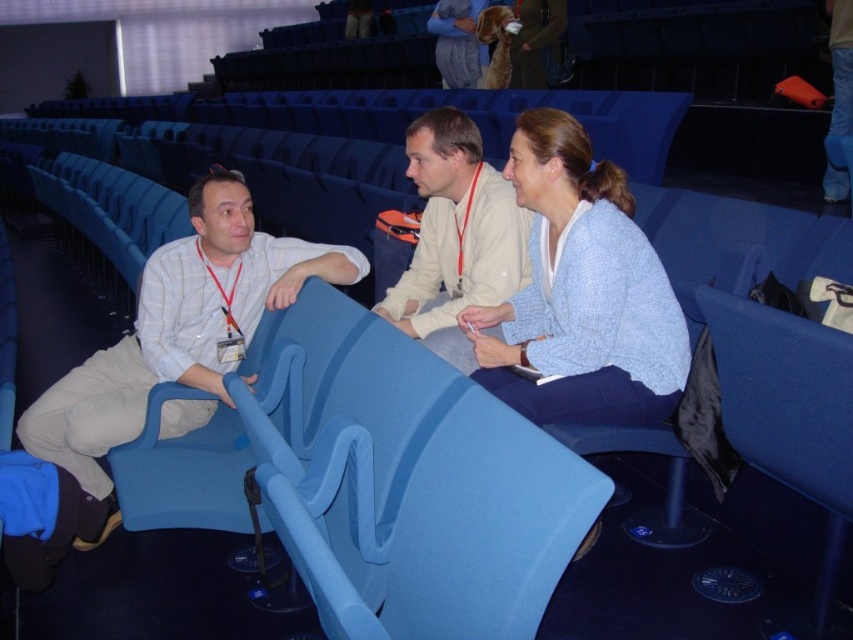
Question: Estimate the real-world distances between objects in this image. Which object is farther from the light blue knit sweater at center?

Choices:
 (A) white striped shirt at left
 (B) light beige shirt at center

Answer: (A)

Question: Can you confirm if light blue knit sweater at center is thinner than white striped shirt at left?

Choices:
 (A) yes
 (B) no

Answer: (A)

Question: Can you confirm if white striped shirt at left is positioned above light beige shirt at center?

Choices:
 (A) yes
 (B) no

Answer: (B)

Question: Which point appears farthest from the camera in this image?

Choices:
 (A) (498, 244)
 (B) (537, 330)
 (C) (223, 224)

Answer: (A)

Question: Is light blue knit sweater at center positioned before light beige shirt at center?

Choices:
 (A) yes
 (B) no

Answer: (A)

Question: Which is farther from the white striped shirt at left?

Choices:
 (A) light beige shirt at center
 (B) light blue knit sweater at center

Answer: (B)